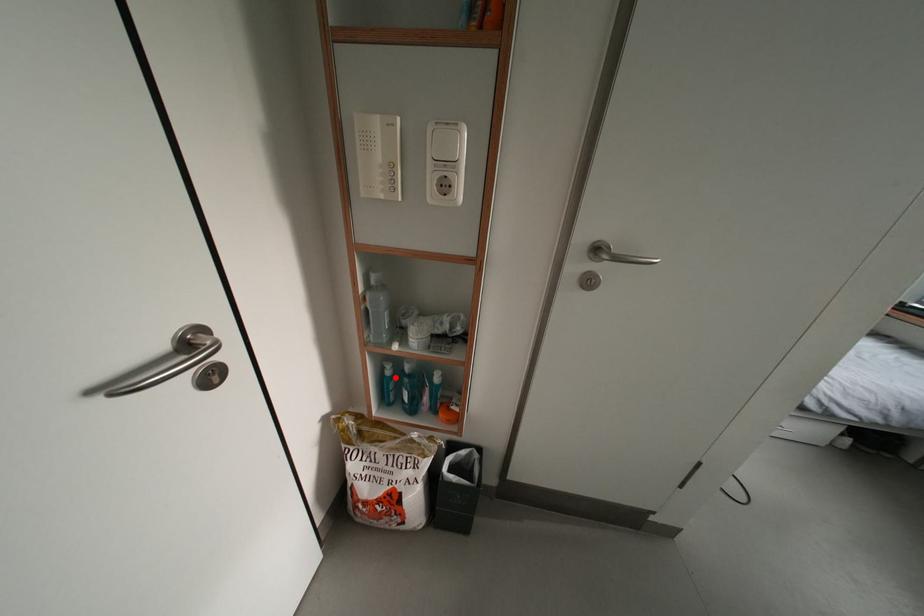
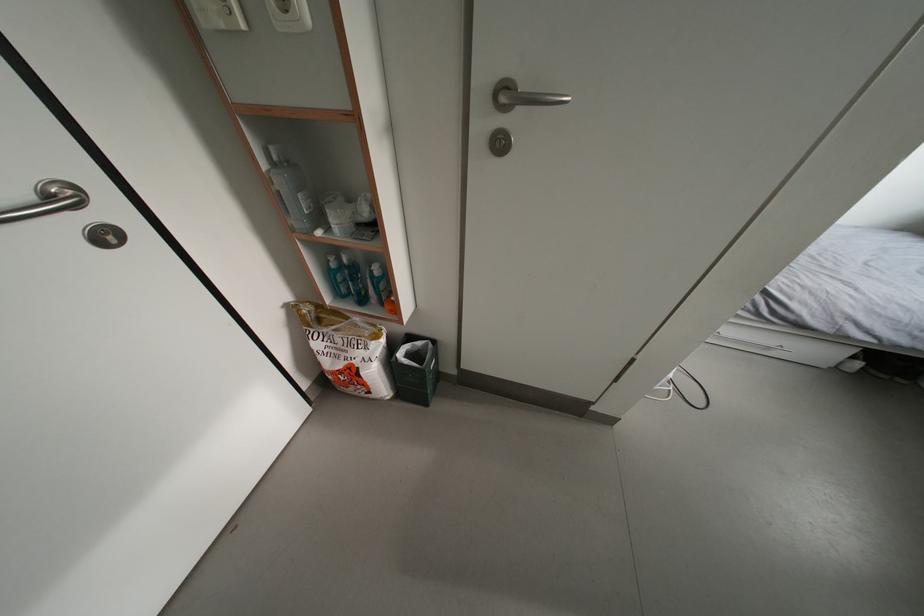
Question: I am providing you with two images of the same scene from different viewpoints. Image1 has a red point marked. In image2, the corresponding 3D location appears at what relative position? Reply with the corresponding letter.

Choices:
 (A) Closer
 (B) Farther

Answer: (A)